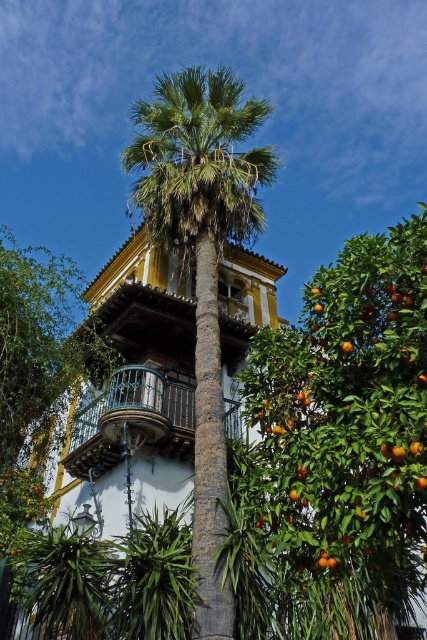
You are standing at the point labeled point (228, 588) and want to walk towards the building. Will you pass by point (178, 440) before reaching the building?

Yes, because point (228, 588) is in front of point (178, 440), so walking towards the building from point (228, 588) would require passing point (178, 440) first.

You are an architect designing a new garden layout. You need to place a statue exactly at the point marked by the coordinates point (345,440). According to the scene, what object will the statue be placed near?

The statue will be placed near the orange matte leathery fruit tree at upper right, as the point (345,440) marks its location.

You are a painter standing at the base of the green leafy palm at center. You want to paint the black wrought iron balcony at center. Can you see it clearly from your current position?

The green leafy palm at center is positioned over the black wrought iron balcony at center, so the palm tree may block your view of the balcony. Move to the side of the palm tree to get a clear view.